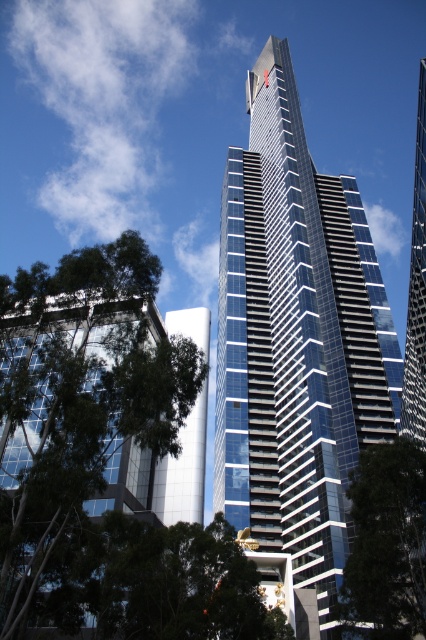
You are a city planner assessing the view from a new park being built at the base of the glassy blue skyscraper at center. The park will have a pathway leading to the green leafy tree at lower right. Considering the size difference between the two, which object will appear closer to the park visitors when they look towards the tree?

The green leafy tree at lower right will appear closer to the park visitors because it is smaller in size than the glassy blue skyscraper at center, making the tree seem nearer in the visual perspective.

You are a city planner evaluating the impact of new construction on sunlight availability. You notice the glassy blue skyscraper at center and the green leafy tree at lower right. Which object would cast a longer shadow during midday in summer?

The glassy blue skyscraper at center is much taller as green leafy tree at lower right, so it would cast a longer shadow during midday in summer.